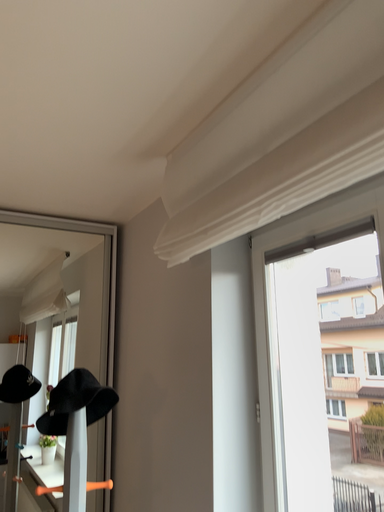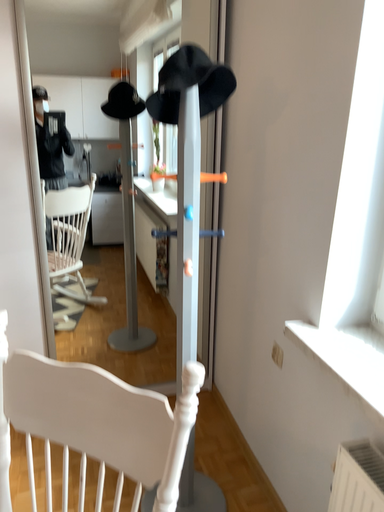
Question: Which way did the camera rotate in the video?

Choices:
 (A) rotated left
 (B) rotated right

Answer: (A)